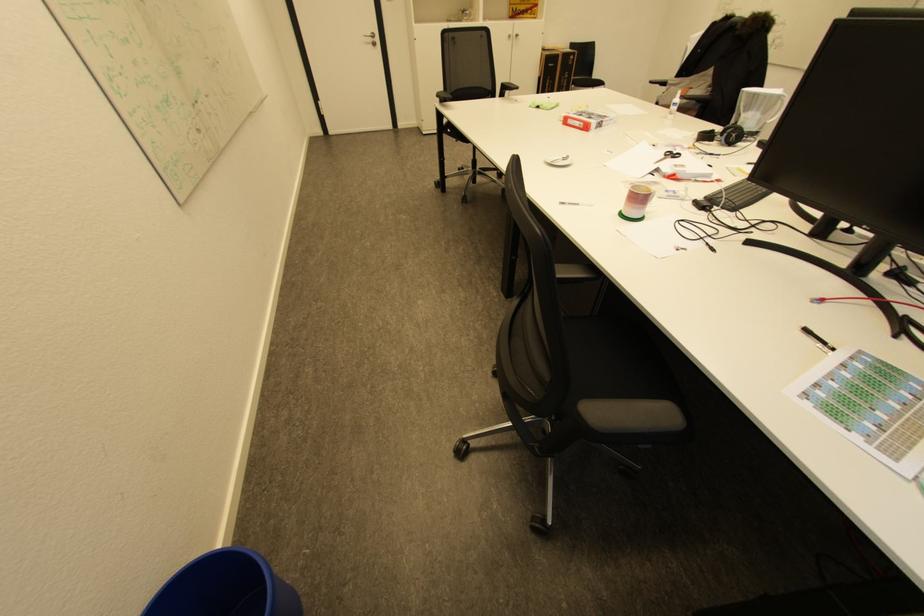
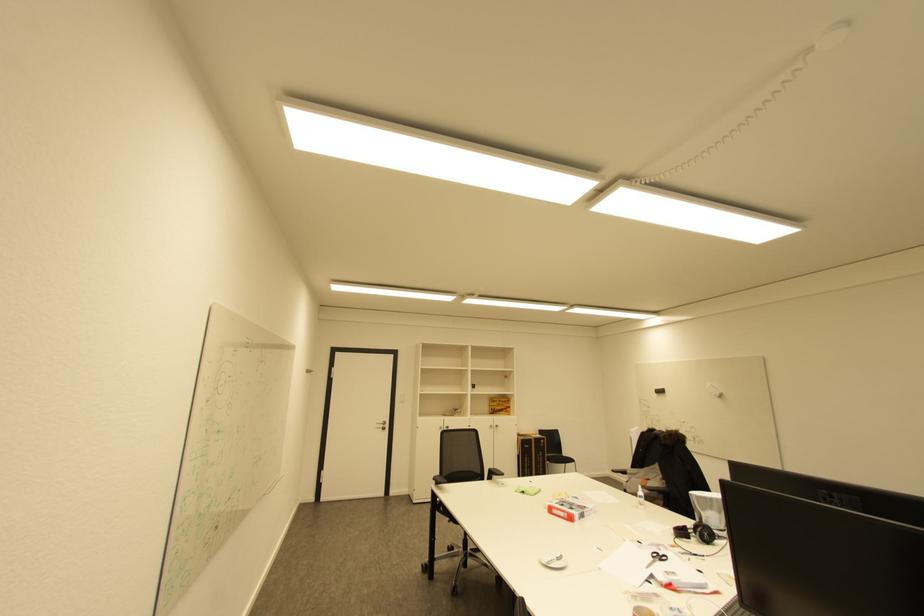
Where in the second image is the point corresponding to point (675, 105) from the first image?

(641, 496)